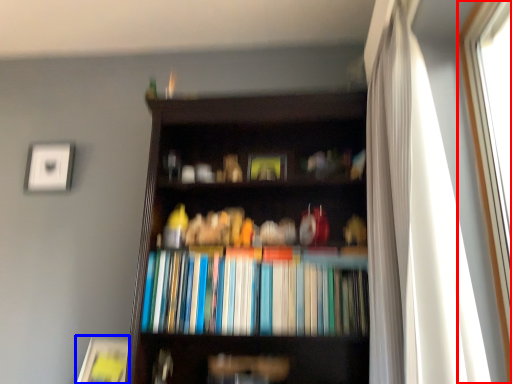
Question: Among these objects, which one is farthest to the camera, window (highlighted by a red box) or paperback book (highlighted by a blue box)?

Choices:
 (A) window
 (B) paperback book

Answer: (B)